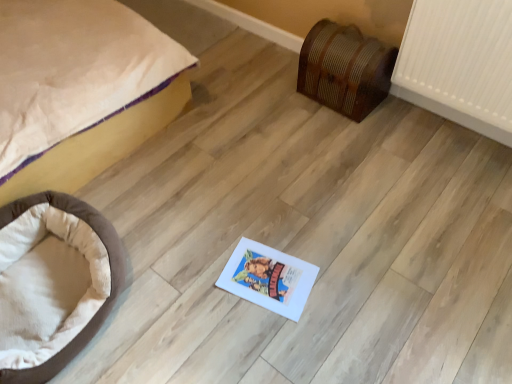
Question: Is wooden chest at right not inside brown plush dog bed at lower left?

Choices:
 (A) no
 (B) yes

Answer: (B)

Question: Can you confirm if wooden chest at right is bigger than brown plush dog bed at lower left?

Choices:
 (A) no
 (B) yes

Answer: (A)

Question: Is wooden chest at right oriented towards brown plush dog bed at lower left?

Choices:
 (A) yes
 (B) no

Answer: (A)

Question: Does wooden chest at right lie behind brown plush dog bed at lower left?

Choices:
 (A) yes
 (B) no

Answer: (A)

Question: From a real-world perspective, is wooden chest at right located higher than brown plush dog bed at lower left?

Choices:
 (A) yes
 (B) no

Answer: (A)

Question: From a real-world perspective, is wooden chest at right located beneath brown plush dog bed at lower left?

Choices:
 (A) yes
 (B) no

Answer: (B)

Question: Is brown plush dog bed at lower left behind beige fabric bed at left?

Choices:
 (A) no
 (B) yes

Answer: (B)

Question: Can you confirm if brown plush dog bed at lower left is bigger than beige fabric bed at left?

Choices:
 (A) no
 (B) yes

Answer: (A)

Question: Is brown plush dog bed at lower left with beige fabric bed at left?

Choices:
 (A) yes
 (B) no

Answer: (B)

Question: From the image's perspective, would you say brown plush dog bed at lower left is shown under beige fabric bed at left?

Choices:
 (A) yes
 (B) no

Answer: (A)

Question: From a real-world perspective, is brown plush dog bed at lower left physically above beige fabric bed at left?

Choices:
 (A) no
 (B) yes

Answer: (A)

Question: Is brown plush dog bed at lower left oriented away from beige fabric bed at left?

Choices:
 (A) no
 (B) yes

Answer: (B)

Question: From a real-world perspective, is beige fabric bed at left physically above wooden chest at right?

Choices:
 (A) no
 (B) yes

Answer: (B)